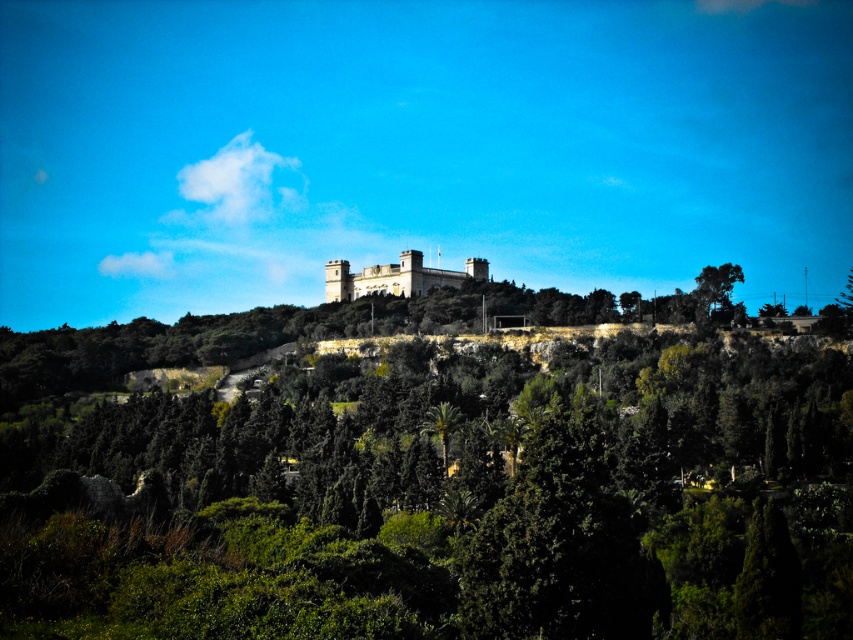
Question: Which object is farther from the camera taking this photo?

Choices:
 (A) green leafy tree at upper right
 (B) stone castle at center

Answer: (B)

Question: Can you confirm if stone castle at center is wider than green leafy tree at upper right?

Choices:
 (A) yes
 (B) no

Answer: (A)

Question: Is the position of stone castle at center more distant than that of green leafy tree at upper right?

Choices:
 (A) yes
 (B) no

Answer: (A)

Question: Which object is closer to the camera taking this photo?

Choices:
 (A) stone castle at center
 (B) green leafy tree at upper right

Answer: (B)

Question: In this image, where is stone castle at center located relative to green leafy tree at upper right?

Choices:
 (A) right
 (B) left

Answer: (B)